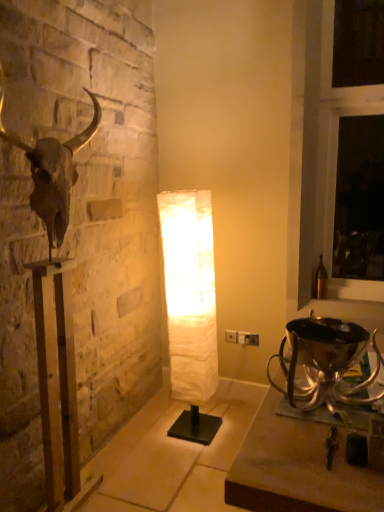
Question: Is white paper lamp at center further to camera compared to metallic gold bull skull at left?

Choices:
 (A) yes
 (B) no

Answer: (A)

Question: Is white paper lamp at center located outside metallic gold bull skull at left?

Choices:
 (A) yes
 (B) no

Answer: (A)

Question: Can you confirm if white paper lamp at center is shorter than metallic gold bull skull at left?

Choices:
 (A) no
 (B) yes

Answer: (B)

Question: Does white paper lamp at center have a lesser width compared to metallic gold bull skull at left?

Choices:
 (A) no
 (B) yes

Answer: (A)

Question: From the image's perspective, is white paper lamp at center on metallic gold bull skull at left?

Choices:
 (A) yes
 (B) no

Answer: (B)

Question: Considering the positions of point (x=54, y=442) and point (x=205, y=478), is point (x=54, y=442) closer or farther from the camera than point (x=205, y=478)?

Choices:
 (A) closer
 (B) farther

Answer: (A)

Question: From the image's perspective, is metallic gold bull skull at left above or below white marble lamp at center?

Choices:
 (A) below
 (B) above

Answer: (B)

Question: Considering the positions of metallic gold bull skull at left and white marble lamp at center in the image, is metallic gold bull skull at left bigger or smaller than white marble lamp at center?

Choices:
 (A) small
 (B) big

Answer: (B)

Question: From a real-world perspective, is metallic gold bull skull at left above or below white marble lamp at center?

Choices:
 (A) below
 (B) above

Answer: (B)

Question: Is shiny silver trophy at lower right bigger or smaller than white paper lamp at center?

Choices:
 (A) big
 (B) small

Answer: (B)

Question: Considering the positions of shiny silver trophy at lower right and white paper lamp at center in the image, is shiny silver trophy at lower right wider or thinner than white paper lamp at center?

Choices:
 (A) thin
 (B) wide

Answer: (B)

Question: Considering their positions, is shiny silver trophy at lower right located in front of or behind white paper lamp at center?

Choices:
 (A) behind
 (B) front

Answer: (B)

Question: Is shiny silver trophy at lower right taller or shorter than white paper lamp at center?

Choices:
 (A) tall
 (B) short

Answer: (B)

Question: In the image, is metallic gold bull skull at left on the left side or the right side of shiny silver trophy at lower right?

Choices:
 (A) right
 (B) left

Answer: (B)

Question: From their relative heights in the image, would you say metallic gold bull skull at left is taller or shorter than shiny silver trophy at lower right?

Choices:
 (A) short
 (B) tall

Answer: (B)